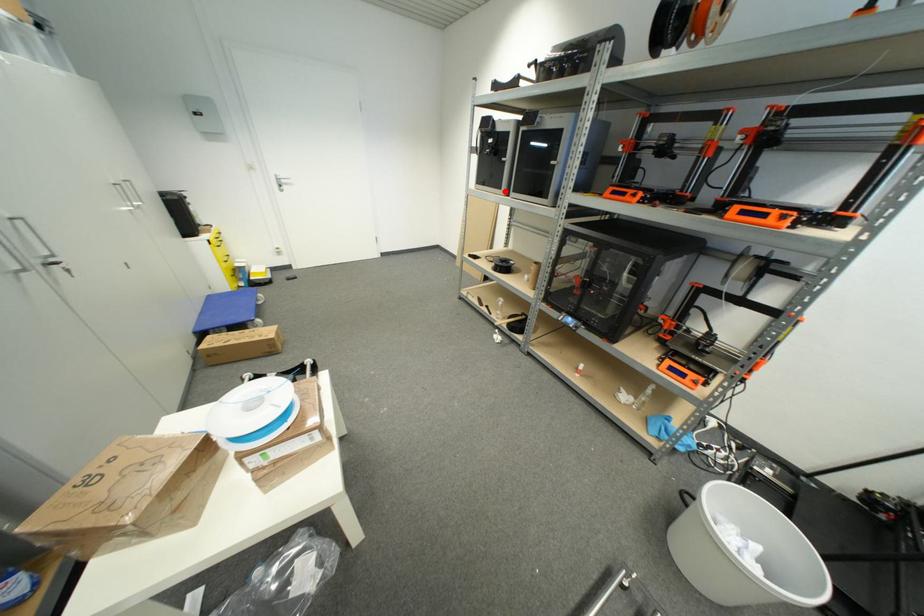
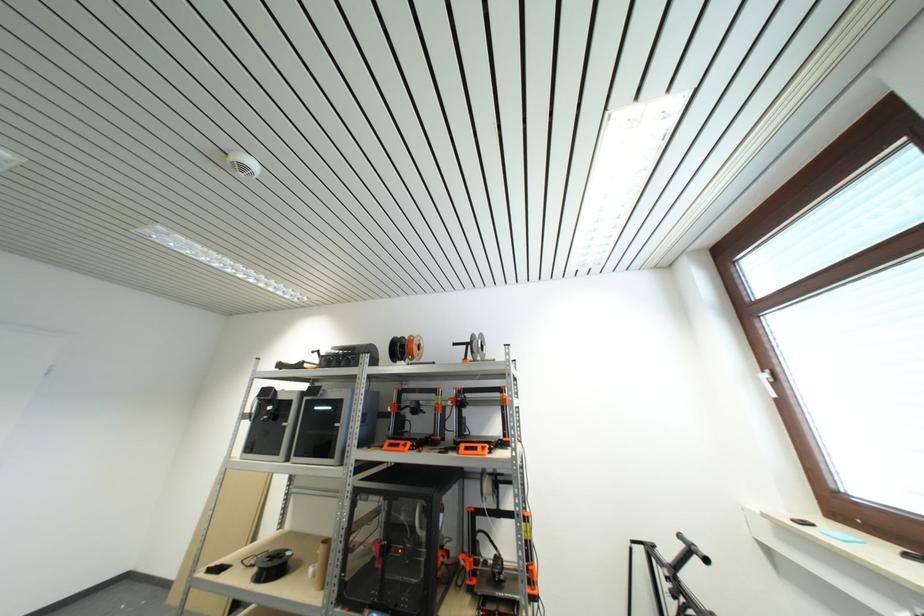
Question: I am providing you with two images of the same scene from different viewpoints. Given a red point in image1, look at the same physical point in image2. Is it:

Choices:
 (A) Closer to the viewpoint
 (B) Farther from the viewpoint

Answer: (B)